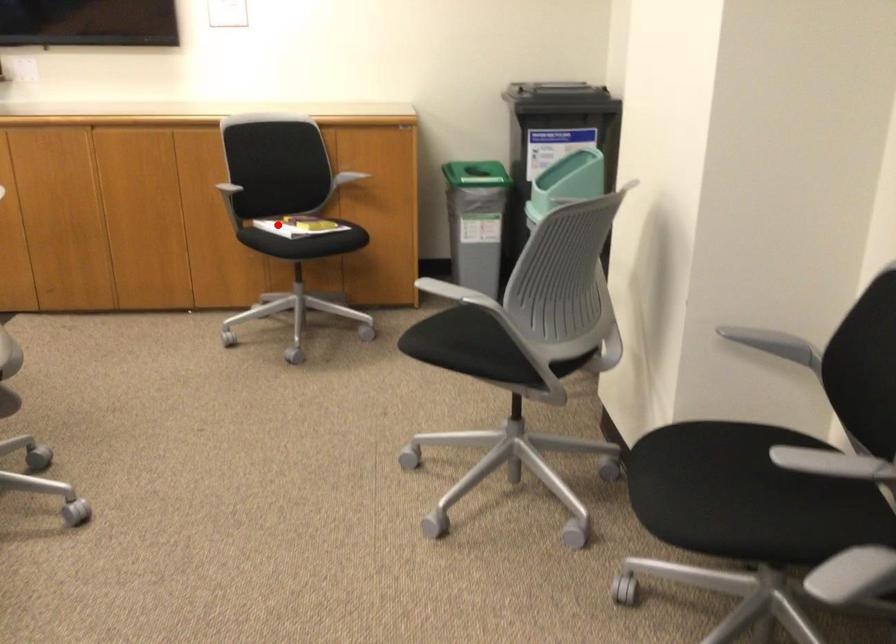
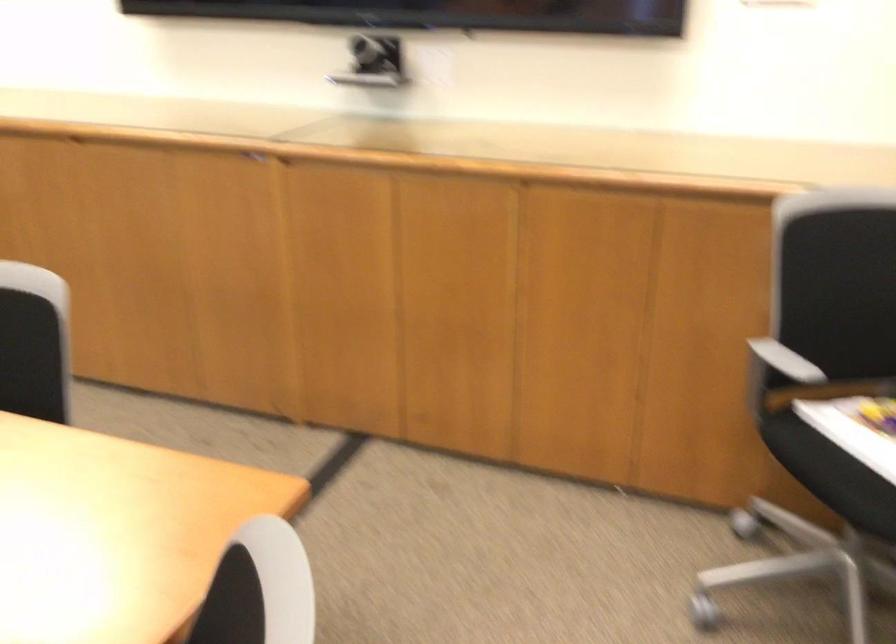
In the second image, find the point that corresponds to the highlighted location in the first image.

(857, 442)